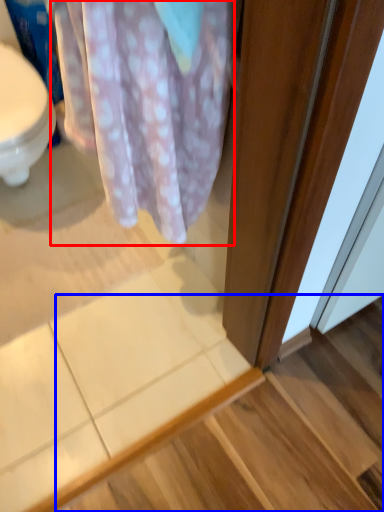
Question: Which object appears closest to the camera in this image, blanket (highlighted by a red box) or stair (highlighted by a blue box)?

Choices:
 (A) blanket
 (B) stair

Answer: (A)